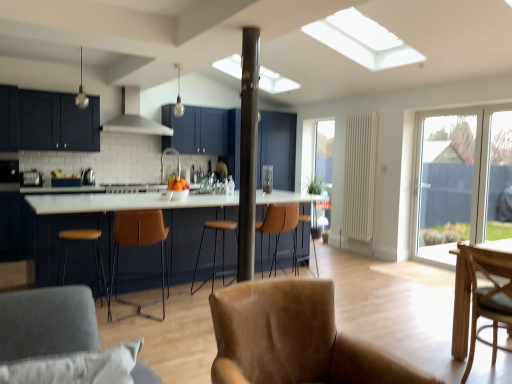
Question: Is brown leather bar stool at left, positioned as the third bar stool in right-to-left order, oriented away from metallic silver kettle at center, which is counted as the second appliance, starting from the left?

Choices:
 (A) yes
 (B) no

Answer: (B)

Question: Is brown leather bar stool at left, positioned as the third bar stool in right-to-left order, smaller than metallic silver kettle at center, which is counted as the second appliance, starting from the left?

Choices:
 (A) yes
 (B) no

Answer: (B)

Question: Is brown leather bar stool at left, which appears as the 3th bar stool when viewed from the back, at the left side of metallic silver kettle at center, placed as the first appliance when sorted from back to front?

Choices:
 (A) yes
 (B) no

Answer: (B)

Question: Is brown leather bar stool at left, positioned as the third bar stool in right-to-left order, outside metallic silver kettle at center, placed as the third appliance when sorted from front to back?

Choices:
 (A) yes
 (B) no

Answer: (A)

Question: Does brown leather bar stool at left, positioned as the third bar stool in right-to-left order, have a lesser width compared to metallic silver kettle at center, which is counted as the second appliance, starting from the left?

Choices:
 (A) no
 (B) yes

Answer: (A)

Question: Does brown leather bar stool at left, the 1th bar stool in the front-to-back sequence, have a lesser height compared to metallic silver kettle at center, placed as the first appliance when sorted from back to front?

Choices:
 (A) yes
 (B) no

Answer: (B)

Question: From a real-world perspective, does brown leather chair at center, marked as the 1th chair in a back-to-front arrangement, stand above white glossy table at center?

Choices:
 (A) no
 (B) yes

Answer: (A)

Question: Is brown leather chair at center, marked as the 1th chair in a back-to-front arrangement, looking in the opposite direction of white glossy table at center?

Choices:
 (A) yes
 (B) no

Answer: (B)

Question: Could you tell me if brown leather chair at center, marked as the fourth chair in a right-to-left arrangement, is facing white glossy table at center?

Choices:
 (A) no
 (B) yes

Answer: (B)

Question: Is brown leather chair at center, which is the 4th chair in front-to-back order, not close to white glossy table at center?

Choices:
 (A) yes
 (B) no

Answer: (B)

Question: Does brown leather chair at center, which ranks as the first chair in left-to-right order, have a greater width compared to white glossy table at center?

Choices:
 (A) yes
 (B) no

Answer: (B)

Question: Is brown leather chair at center, marked as the fourth chair in a right-to-left arrangement, further to camera compared to white glossy table at center?

Choices:
 (A) yes
 (B) no

Answer: (B)

Question: Is transparent glass door at right located outside satin silver stove at center?

Choices:
 (A) yes
 (B) no

Answer: (A)